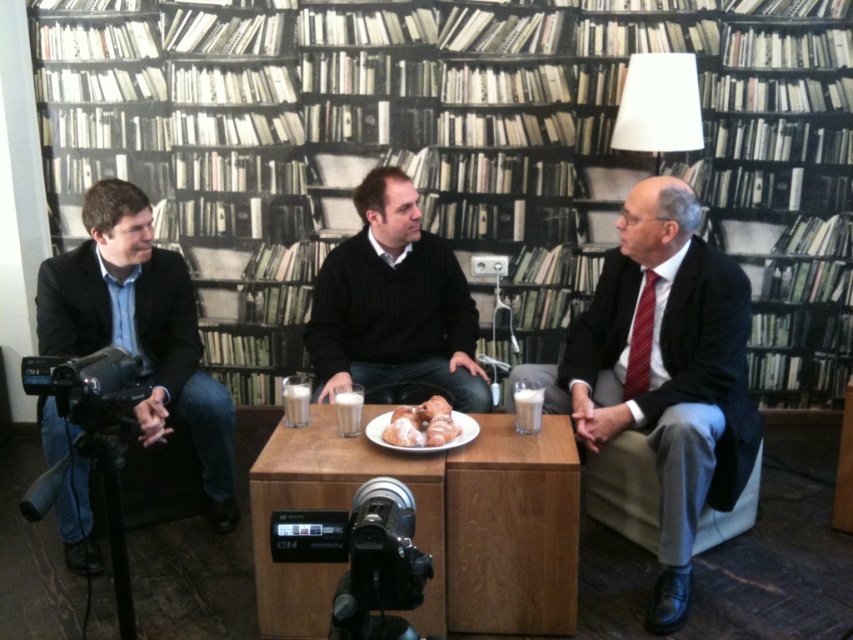
Which of these two, wooden table at center or black sweater at center, stands taller?

black sweater at center is taller.

Does wooden table at center come in front of black sweater at center?

That is True.

I want to click on wooden table at center, so click(433, 525).

I want to click on wooden table at center, so click(433, 525).

Who is positioned more to the left, wooden bookcase at upper center or matte black suit at center?

wooden bookcase at upper center

What do you see at coordinates (457, 150) in the screenshot?
I see `wooden bookcase at upper center` at bounding box center [457, 150].

What do you see at coordinates (457, 150) in the screenshot? I see `wooden bookcase at upper center` at bounding box center [457, 150].

What are the coordinates of `wooden bookcase at upper center` in the screenshot? It's located at (x=457, y=150).

Can you confirm if matte black suit at center is smaller than black plastic video camera at lower center?

Incorrect, matte black suit at center is not smaller in size than black plastic video camera at lower center.

Is point (666, 324) positioned before point (380, 579)?

No, it is not.

This screenshot has height=640, width=853. I want to click on matte black suit at center, so click(664, 372).